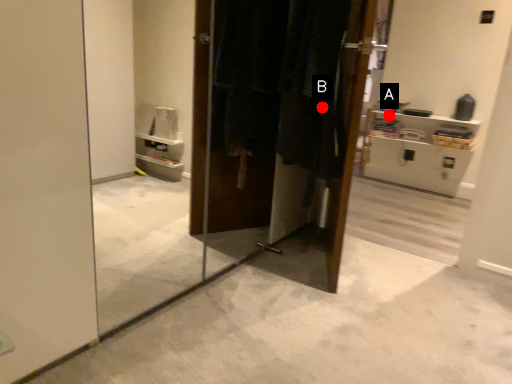
Question: Two points are circled on the image, labeled by A and B beside each circle. Which point appears farthest from the camera in this image?

Choices:
 (A) A is further
 (B) B is further

Answer: (A)